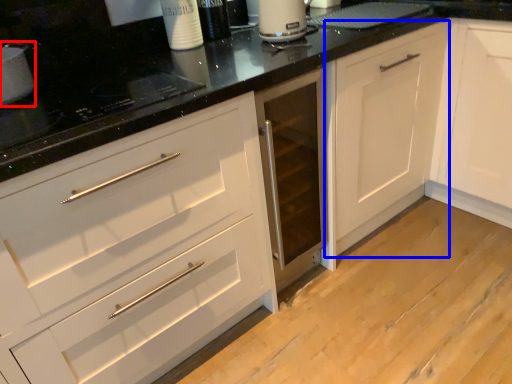
Question: Which point is closer to the camera, appliance (highlighted by a red box) or cabinetry (highlighted by a blue box)?

Choices:
 (A) appliance
 (B) cabinetry

Answer: (A)